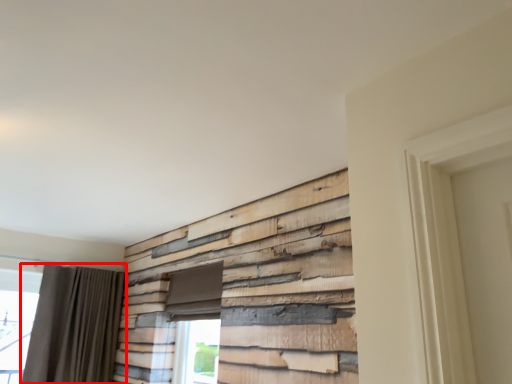
Question: In this image, where is curtain (annotated by the red box) located relative to window?

Choices:
 (A) right
 (B) left

Answer: (B)